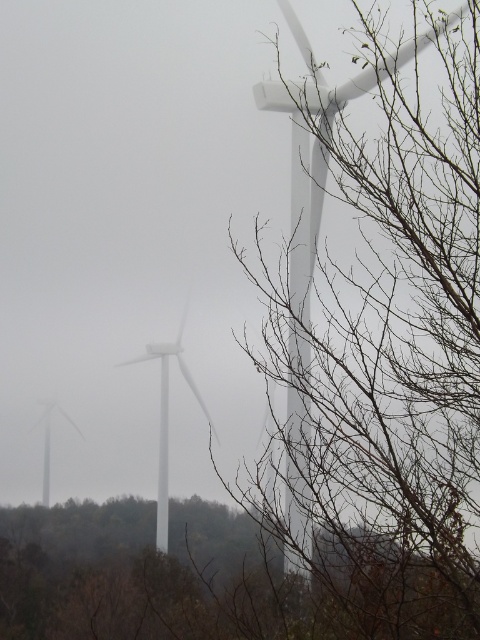
You are an observer looking at the foggy landscape with wind turbines. You notice the bare branches at upper right and the brown leafless branches at lower right. Which of these two branches is located more to the right side of the image?

The bare branches at upper right is positioned on the right side of brown leafless branches at lower right, so it is more to the right in the image.

Consider the image. You are an artist sketching this foggy landscape. You want to emphasize the contrast between the smaller and larger branches. Which branch should you draw first to establish the size relationship between the bare branches at upper right and the brown leafless branches at lower right?

You should draw the brown leafless branches at lower right first because they are larger in size compared to the bare branches at upper right, allowing you to establish the size relationship by contrasting their sizes.

You are an observer looking at the foggy landscape with wind turbines. You notice the bare branches at upper right and the brown leafless branches at lower right. Which set of branches appears nearer to you?

The bare branches at upper right appear nearer to you because they are closer to the viewer than the brown leafless branches at lower right.